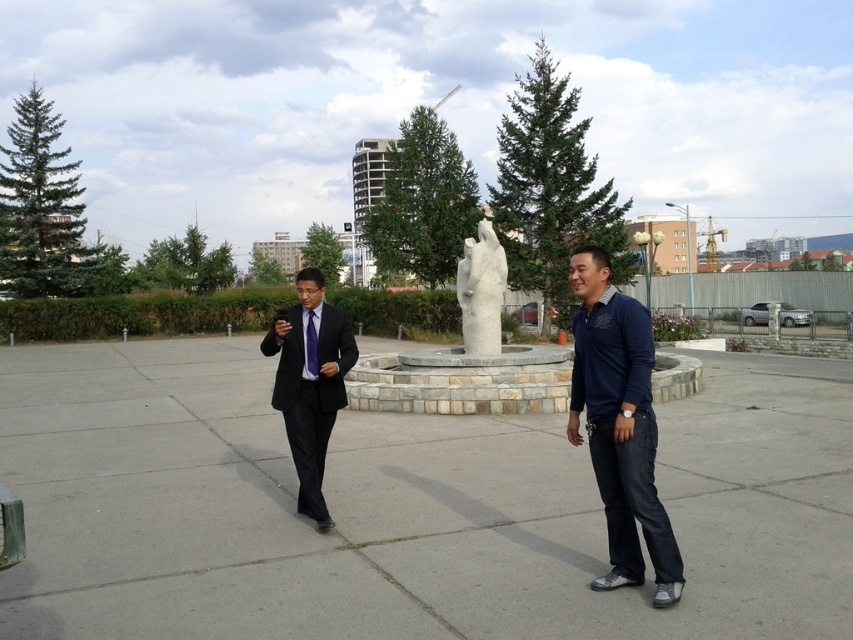
Question: Among these points, which one is farthest from the camera?

Choices:
 (A) (601, 308)
 (B) (474, 280)
 (C) (312, 333)

Answer: (B)

Question: Which point is closer to the camera?

Choices:
 (A) (573, 280)
 (B) (466, 275)
 (C) (282, 378)
 (D) (310, 324)

Answer: (A)

Question: Can you confirm if dark blue denim jeans at center is smaller than black suit at center?

Choices:
 (A) no
 (B) yes

Answer: (B)

Question: Which of these objects is positioned closest to the white marble statue at center?

Choices:
 (A) black suit at center
 (B) dark blue denim jeans at center

Answer: (A)

Question: Is white marble statue at center wider than purple silk tie at center?

Choices:
 (A) yes
 (B) no

Answer: (A)

Question: Observing the image, what is the correct spatial positioning of dark blue denim jeans at center in reference to purple silk tie at center?

Choices:
 (A) above
 (B) below

Answer: (B)